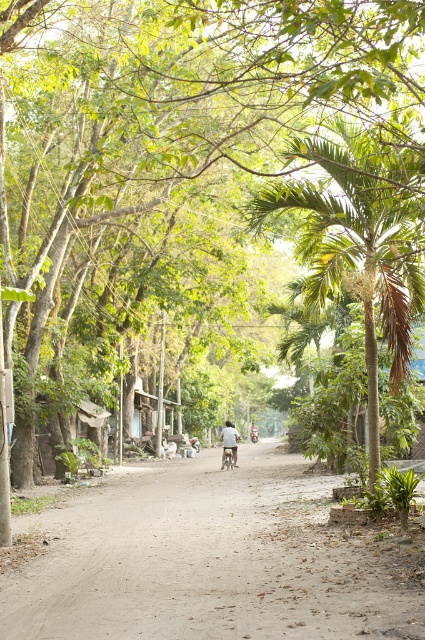
Can you confirm if green leafy palm tree at center is positioned below metallic silver bicycle at center?

No, green leafy palm tree at center is not below metallic silver bicycle at center.

Which is in front, point (388, 257) or point (235, 456)?

Point (388, 257) is more forward.

What do you see at coordinates (359, 244) in the screenshot? The width and height of the screenshot is (425, 640). I see `green leafy palm tree at center` at bounding box center [359, 244].

Where is `green leafy palm tree at center`? This screenshot has height=640, width=425. green leafy palm tree at center is located at coordinates (359, 244).

This screenshot has height=640, width=425. Describe the element at coordinates (359, 244) in the screenshot. I see `green leafy palm tree at center` at that location.

Is point (356, 156) positioned behind point (252, 440)?

No, it is in front of (252, 440).

This screenshot has height=640, width=425. What are the coordinates of `green leafy palm tree at center` in the screenshot? It's located at (359, 244).

Is brown dirt track at center thinner than light brown leather jacket at center?

In fact, brown dirt track at center might be wider than light brown leather jacket at center.

Does brown dirt track at center have a larger size compared to light brown leather jacket at center?

Yes, brown dirt track at center is bigger than light brown leather jacket at center.

Is point (198, 464) positioned behind point (249, 429)?

No, (198, 464) is closer to viewer.

The image size is (425, 640). I want to click on brown dirt track at center, so click(210, 560).